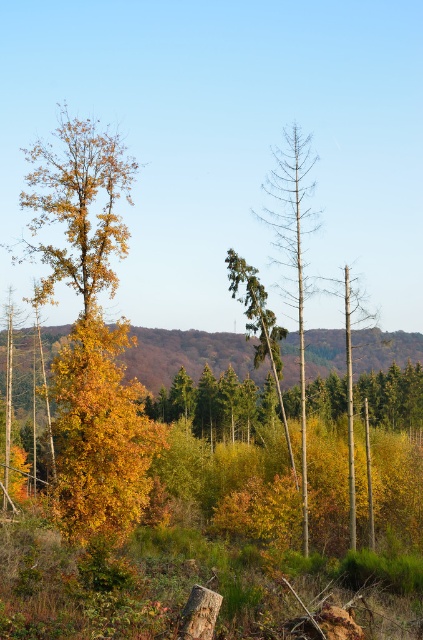
Question: Which of the following is the farthest from the observer?

Choices:
 (A) (304, 138)
 (B) (93, 243)
 (C) (249, 340)

Answer: (C)

Question: Which object appears closest to the camera in this image?

Choices:
 (A) smooth brown tree trunk at center
 (B) bare wood tree at center

Answer: (B)

Question: Is bare wood tree at center to the left of smooth brown tree trunk at center from the viewer's perspective?

Choices:
 (A) no
 (B) yes

Answer: (B)

Question: Is autumn foliage at center behind bare wood tree at center?

Choices:
 (A) no
 (B) yes

Answer: (B)

Question: Is autumn foliage at center to the left of bare wood tree at center from the viewer's perspective?

Choices:
 (A) yes
 (B) no

Answer: (A)

Question: Which object appears closest to the camera in this image?

Choices:
 (A) bare wood tree at center
 (B) smooth brown tree trunk at center

Answer: (A)